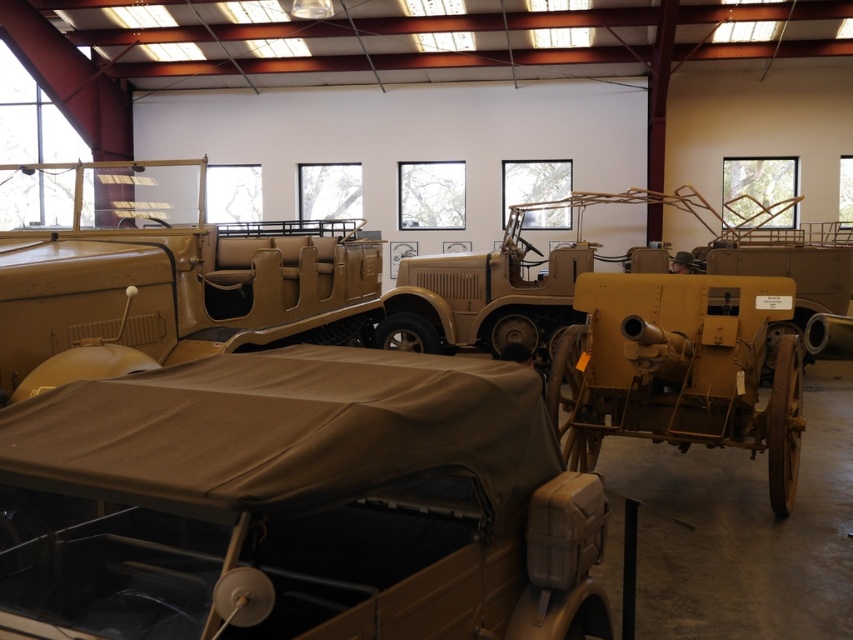
Does matte khaki car at center appear on the left side of matte tan jeep at center?

In fact, matte khaki car at center is to the right of matte tan jeep at center.

Can you confirm if matte khaki car at center is taller than matte tan jeep at center?

No, matte khaki car at center is not taller than matte tan jeep at center.

Is point (131, 593) farther from viewer compared to point (0, 371)?

No, (131, 593) is in front of (0, 371).

Locate an element on the screen. matte khaki car at center is located at coordinates (297, 504).